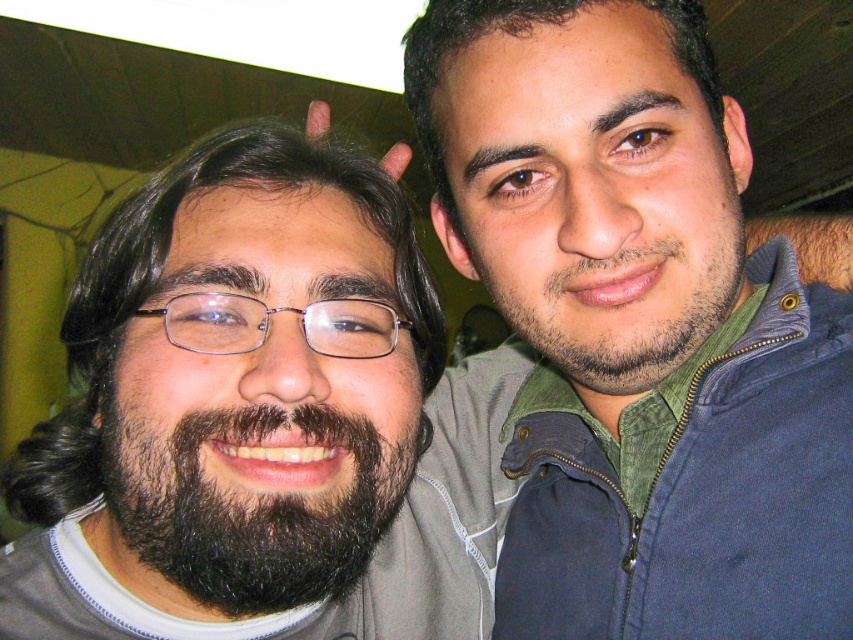
From the picture: You are a photographer adjusting the lighting in the studio. You need to place a spotlight at the point that is closer to the camera. Which point should you choose between point (677, 296) and point (555, 340)?

Point (555, 340) is further away from the camera than point (677, 296). Therefore, you should place the spotlight at point (677, 296) because it is closer to the camera.

Consider the image. You are a photographer setting up for a group photo. You need to adjust the camera height to ensure both the dark brown hair at center and the black fuzzy beard at left are fully visible in the frame. Which object should you focus on to determine the appropriate camera height?

The dark brown hair at center is much taller than the black fuzzy beard at left, so you should focus on the dark brown hair at center to determine the appropriate camera height to ensure both are fully visible.